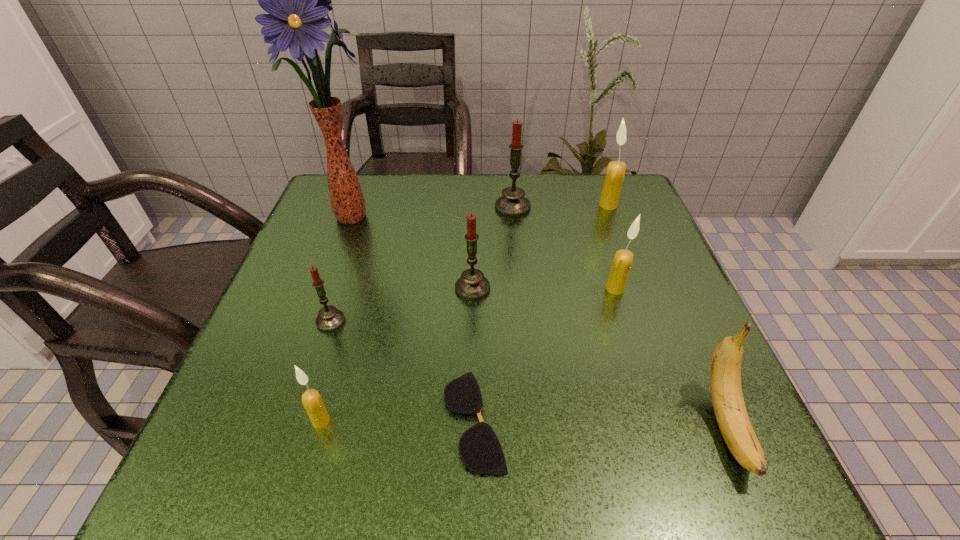
Identify the location of object that is positioned at the far left corner. Image resolution: width=960 pixels, height=540 pixels. (297, 0).

Image resolution: width=960 pixels, height=540 pixels. I want to click on object positioned at the far right corner, so click(x=615, y=173).

I want to click on object at the near right corner, so click(x=725, y=370).

Find the location of a particular element. This screenshot has width=960, height=540. blank space at the far edge is located at coordinates (542, 188).

At what (x,y) coordinates should I click in order to perform the action: click on vacant space at the near edge of the desktop. Please return your answer as a coordinate pair (x, y). Image resolution: width=960 pixels, height=540 pixels. Looking at the image, I should click on (450, 484).

You are a GUI agent. You are given a task and a screenshot of the screen. Output one action in this format:
    pyautogui.click(x=<x>, y=<y>)
    Task: Click on the vacant point at the left edge
    Image resolution: width=960 pixels, height=540 pixels.
    Given the screenshot: What is the action you would take?
    pyautogui.click(x=262, y=333)

I want to click on vacant space at the right edge of the desktop, so click(x=640, y=296).

I want to click on vacant region at the near left corner of the desktop, so click(x=179, y=494).

Identify the location of vacant space at the far right corner. (595, 186).

Where is `vacant region between the leftmost cream candle and the shortest object`? The height and width of the screenshot is (540, 960). vacant region between the leftmost cream candle and the shortest object is located at coordinates (397, 421).